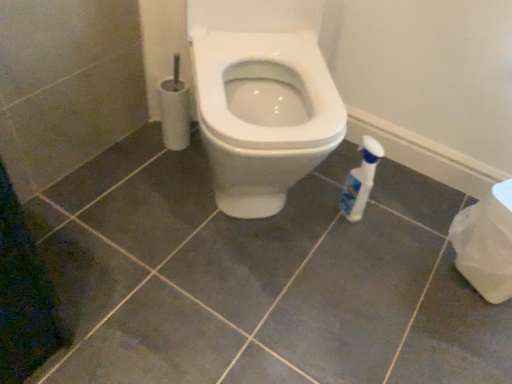
Find the location of a particular element. The height and width of the screenshot is (384, 512). vacant space behind white plastic spray bottle at lower right is located at coordinates (342, 178).